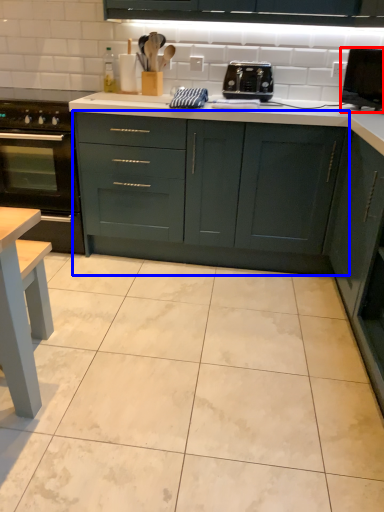
Question: Which point is further to the camera, appliance (highlighted by a red box) or cabinetry (highlighted by a blue box)?

Choices:
 (A) appliance
 (B) cabinetry

Answer: (B)